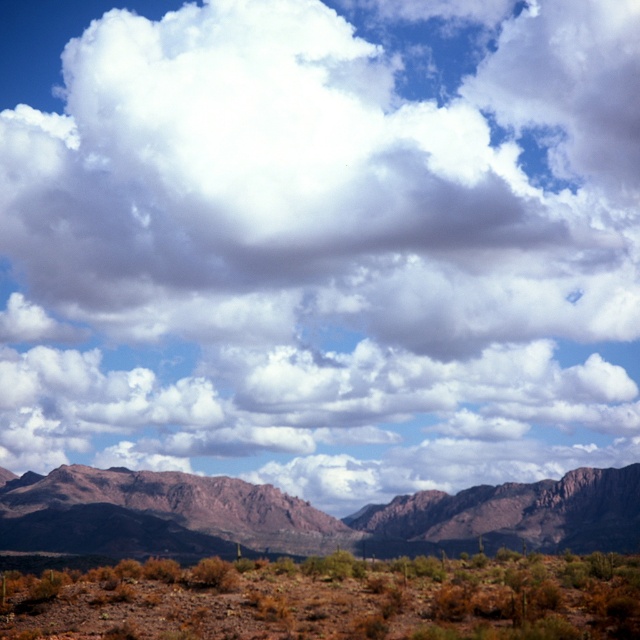
You are a hiker who wants to cross the desert. You see the brown dirt at lower center and the rugged rock mountain range at center. Which direction should you go to avoid climbing the mountains?

You should go to the left of the rugged rock mountain range at center because the brown dirt at lower center is located to the right of it, so moving left would avoid the mountain range.

You are standing in the desert and see both the rugged rock mountain range at center and the rustic brown rock formation at center. Which one appears nearer to you?

The rugged rock mountain range at center appears nearer because it is closer to the viewer than the rustic brown rock formation at center.